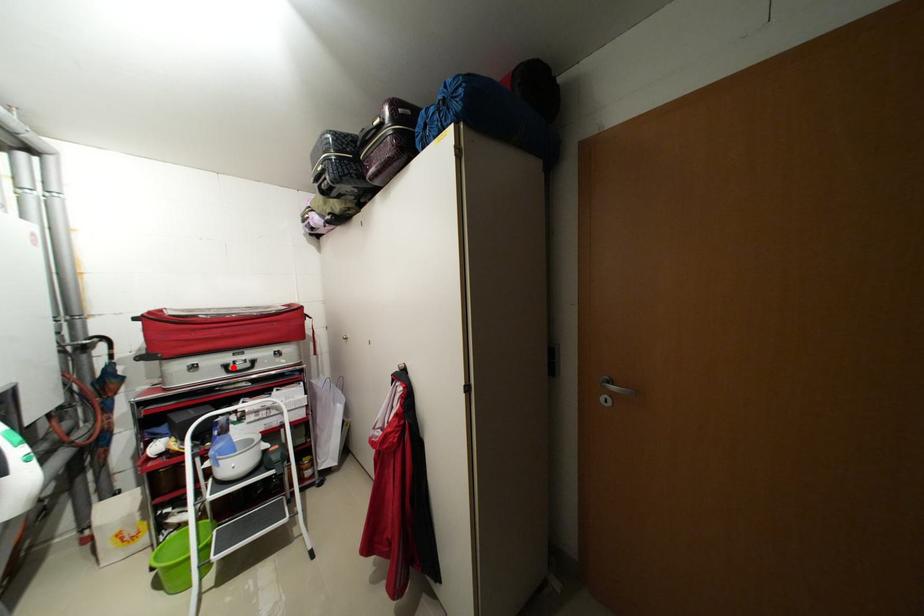
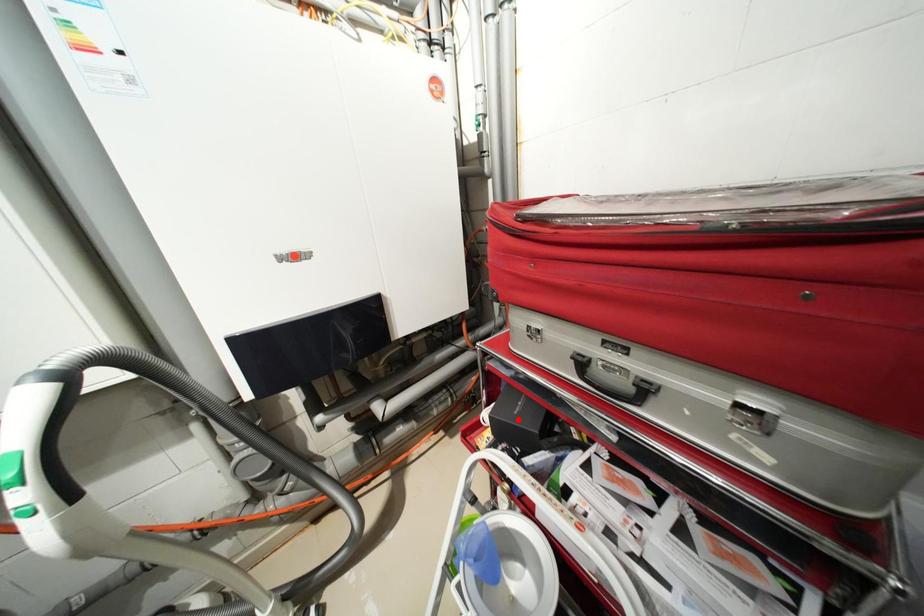
I am providing you with two images of the same scene from different viewpoints. A red point is marked on the first image and another point is marked on the second image. Does the point marked in image1 correspond to the same location as the one in image2?

No